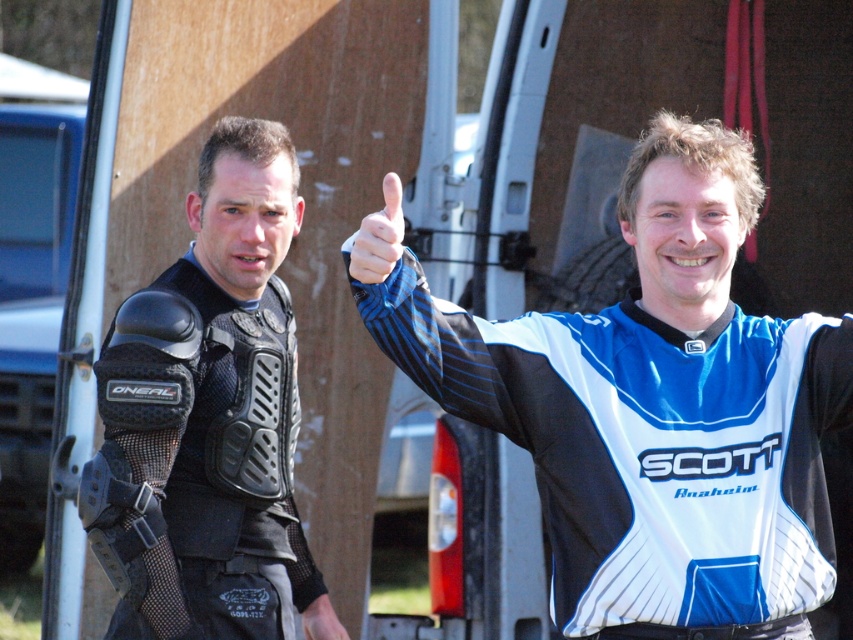
Question: Which object appears farthest from the camera in this image?

Choices:
 (A) matte black thumb at upper center
 (B) black mesh glove at lower center
 (C) black mesh vest at left
 (D) white/blue/black jersey at right

Answer: (B)

Question: Which of the following is the closest to the observer?

Choices:
 (A) (141, 410)
 (B) (340, 625)
 (C) (589, 452)
 (D) (401, 220)

Answer: (D)

Question: Does white/blue/black jersey at right have a lesser width compared to matte black thumb at upper center?

Choices:
 (A) no
 (B) yes

Answer: (A)

Question: Is white/blue/black jersey at right above black mesh vest at left?

Choices:
 (A) yes
 (B) no

Answer: (B)

Question: Does white/blue/black jersey at right have a greater width compared to matte black thumb at upper center?

Choices:
 (A) yes
 (B) no

Answer: (A)

Question: Among these objects, which one is farthest from the camera?

Choices:
 (A) black mesh vest at left
 (B) matte black thumb at upper center
 (C) black mesh glove at lower center
 (D) white/blue/black jersey at right

Answer: (C)